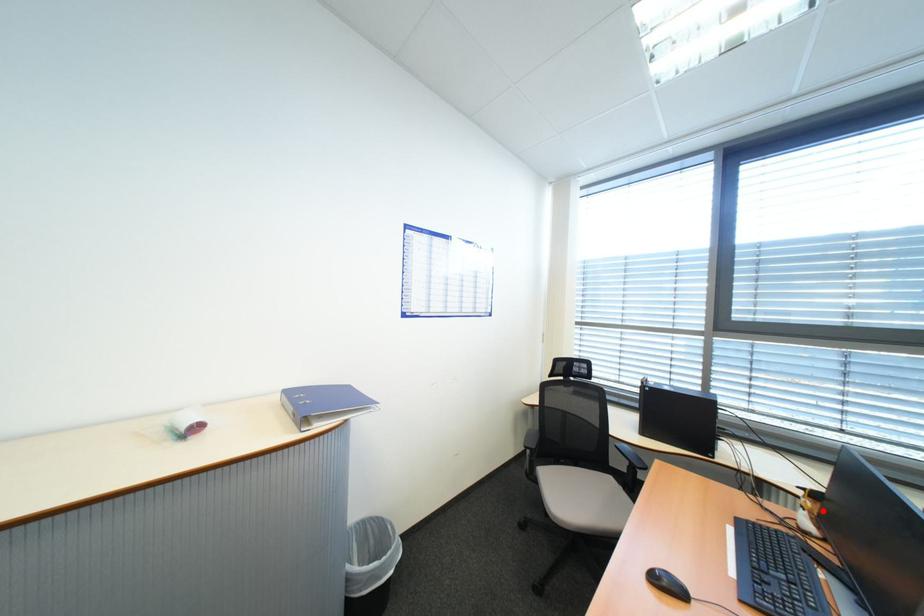
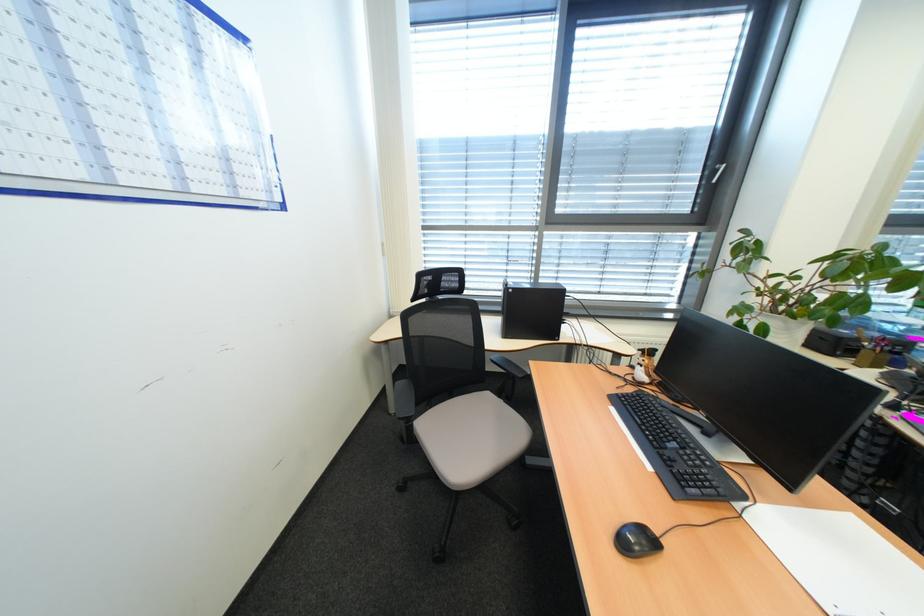
Locate, in the second image, the point that corresponds to the highlighted location in the first image.

(659, 366)